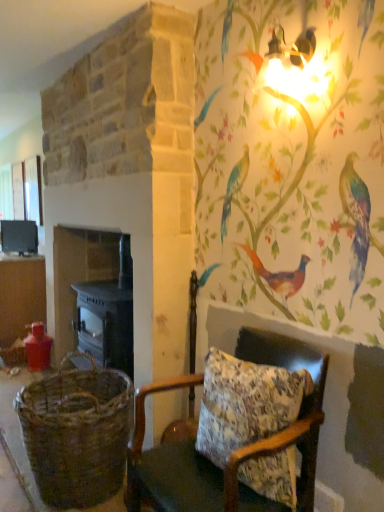
What do you see at coordinates (21, 295) in the screenshot? The height and width of the screenshot is (512, 384). I see `matte brown table at left` at bounding box center [21, 295].

You are a GUI agent. You are given a task and a screenshot of the screen. Output one action in this format:
    pyautogui.click(x=<x>, y=<y>)
    Task: Click on the woven brown basket at lower left
    
    Given the screenshot: What is the action you would take?
    pyautogui.click(x=77, y=433)

The width and height of the screenshot is (384, 512). What do you see at coordinates (19, 236) in the screenshot?
I see `matte black stove at left` at bounding box center [19, 236].

Locate an element on the screen. dark gray stone fireplace at left is located at coordinates (94, 296).

In terms of size, does matte brown table at left appear bigger or smaller than matte black stove at left?

Clearly, matte brown table at left is larger in size than matte black stove at left.

How far apart are matte brown table at left and matte black stove at left?

matte brown table at left is 16.69 inches away from matte black stove at left.

Considering the relative sizes of matte brown table at left and matte black stove at left in the image provided, is matte brown table at left taller than matte black stove at left?

Indeed, matte brown table at left has a greater height compared to matte black stove at left.

Is matte black stove at left a part of matte brown table at left?

No, matte black stove at left is located outside of matte brown table at left.

How different are the orientations of woven brown basket at lower left and matte black stove at left in degrees?

woven brown basket at lower left and matte black stove at left are facing 29.1 degrees away from each other.

In the scene shown: From the image's perspective, which one is positioned lower, woven brown basket at lower left or matte black stove at left?

From the image's view, woven brown basket at lower left is below.

Is woven brown basket at lower left not inside matte black stove at left?

That's correct, woven brown basket at lower left is outside of matte black stove at left.

Looking at this image, does floral fabric cushion at lower right have a lesser height compared to matte black stove at left?

No.

Is floral fabric cushion at lower right located outside matte black stove at left?

That's correct, floral fabric cushion at lower right is outside of matte black stove at left.

Does floral fabric cushion at lower right come in front of matte black stove at left?

Yes, floral fabric cushion at lower right is closer to the camera.

I want to click on basket on the right side of matte black stove at left, so click(x=77, y=433).

From a real-world perspective, is matte black stove at left positioned above or below woven brown basket at lower left?

matte black stove at left is situated higher than woven brown basket at lower left in the real world.

Is matte black stove at left far from woven brown basket at lower left?

Absolutely, matte black stove at left is distant from woven brown basket at lower left.

Looking at their sizes, would you say matte black stove at left is wider or thinner than woven brown basket at lower left?

Considering their sizes, matte black stove at left looks slimmer than woven brown basket at lower left.

How distant is matte black stove at left from floral fabric cushion at lower right?

matte black stove at left and floral fabric cushion at lower right are 3.51 meters apart.

Is matte black stove at left facing away from floral fabric cushion at lower right?

No, matte black stove at left is not facing away from floral fabric cushion at lower right.

Does point (12, 245) come closer to viewer compared to point (225, 494)?

That is False.

Looking at their sizes, would you say matte black stove at left is wider or thinner than floral fabric cushion at lower right?

In the image, matte black stove at left appears to be more narrow than floral fabric cushion at lower right.

Does point (142, 499) appear closer or farther from the camera than point (34, 265)?

Point (142, 499) appears to be closer to the viewer than point (34, 265).

Is floral fabric cushion at lower right with matte brown table at left?

floral fabric cushion at lower right and matte brown table at left are clearly separated.

Does floral fabric cushion at lower right lie behind matte brown table at left?

No, floral fabric cushion at lower right is closer to the viewer.

Between floral fabric cushion at lower right and matte brown table at left, which one has less height?

Standing shorter between the two is floral fabric cushion at lower right.

Considering the sizes of objects dark gray stone fireplace at left and woven brown basket at lower left in the image provided, who is shorter, dark gray stone fireplace at left or woven brown basket at lower left?

woven brown basket at lower left is shorter.

Is dark gray stone fireplace at left bigger or smaller than woven brown basket at lower left?

Considering their sizes, dark gray stone fireplace at left takes up more space than woven brown basket at lower left.

Does dark gray stone fireplace at left appear on the right side of woven brown basket at lower left?

Incorrect, dark gray stone fireplace at left is not on the right side of woven brown basket at lower left.

Is dark gray stone fireplace at left positioned far away from woven brown basket at lower left?

Yes.

The width and height of the screenshot is (384, 512). Find the location of `table below the matte black stove at left (from the image's perspective)`. table below the matte black stove at left (from the image's perspective) is located at coordinates (21, 295).

Where is `appliance behind the woven brown basket at lower left`? appliance behind the woven brown basket at lower left is located at coordinates (19, 236).

Looking at the image, which one is located closer to matte black stove at left, matte brown table at left or woven brown basket at lower left?

Based on the image, matte brown table at left appears to be nearer to matte black stove at left.

Which object lies further to the anchor point matte brown table at left, floral fabric cushion at lower right or dark gray stone fireplace at left?

floral fabric cushion at lower right lies further to matte brown table at left than the other object.

From the image, which object appears to be nearer to matte black stove at left, dark gray stone fireplace at left or floral fabric cushion at lower right?

The object closer to matte black stove at left is dark gray stone fireplace at left.

Consider the image. Estimate the real-world distances between objects in this image. Which object is further from matte black stove at left, woven brown basket at lower left or floral fabric cushion at lower right?

Among the two, floral fabric cushion at lower right is located further to matte black stove at left.

Which object lies nearer to the anchor point matte brown table at left, dark gray stone fireplace at left or woven brown basket at lower left?

dark gray stone fireplace at left is positioned closer to the anchor matte brown table at left.

Estimate the real-world distances between objects in this image. Which object is closer to floral fabric cushion at lower right, matte black stove at left or woven brown basket at lower left?

Based on the image, woven brown basket at lower left appears to be nearer to floral fabric cushion at lower right.

From the image, which object appears to be nearer to dark gray stone fireplace at left, woven brown basket at lower left or matte brown table at left?

matte brown table at left is closer to dark gray stone fireplace at left.

Considering their positions, is matte black stove at left positioned closer to dark gray stone fireplace at left than woven brown basket at lower left?

Among the two, matte black stove at left is located nearer to dark gray stone fireplace at left.

Where is `fireplace positioned between woven brown basket at lower left and matte brown table at left from near to far`? The height and width of the screenshot is (512, 384). fireplace positioned between woven brown basket at lower left and matte brown table at left from near to far is located at coordinates (94, 296).

The height and width of the screenshot is (512, 384). I want to click on table between woven brown basket at lower left and matte black stove at left along the z-axis, so click(x=21, y=295).

Where is `fireplace positioned between floral fabric cushion at lower right and matte brown table at left from near to far`? This screenshot has width=384, height=512. fireplace positioned between floral fabric cushion at lower right and matte brown table at left from near to far is located at coordinates (94, 296).

You are a GUI agent. You are given a task and a screenshot of the screen. Output one action in this format:
    pyautogui.click(x=<x>, y=<y>)
    Task: Click on the basket between floral fabric cushion at lower right and dark gray stone fireplace at left along the z-axis
    This screenshot has width=384, height=512.
    Given the screenshot: What is the action you would take?
    pyautogui.click(x=77, y=433)